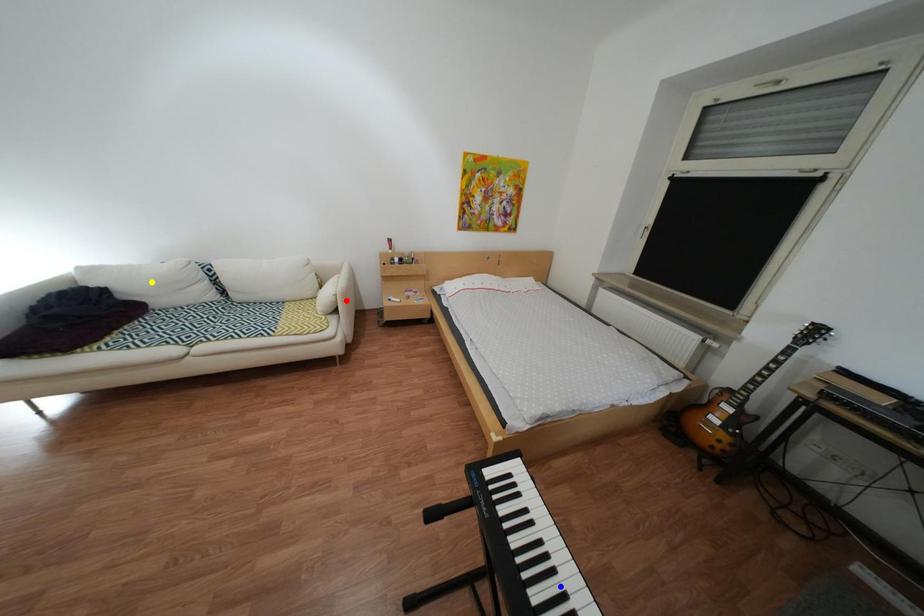
Order these from nearest to farthest:
yellow point, blue point, red point

1. blue point
2. yellow point
3. red point